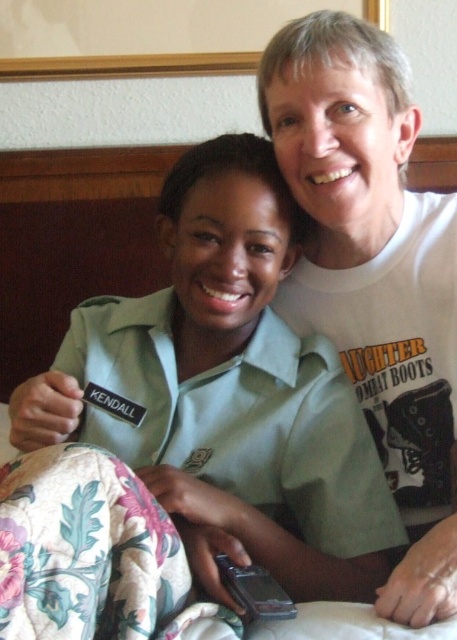
You are standing in the room and want to move from the point at coordinates point (244, 449) to the point at coordinates point (426, 582). Can you walk directly from the first point to the second point without any obstacles?

Point (244, 449) is behind point (426, 582), so you cannot walk directly from the first point to the second point without any obstacles because the second point is in front of the first point.